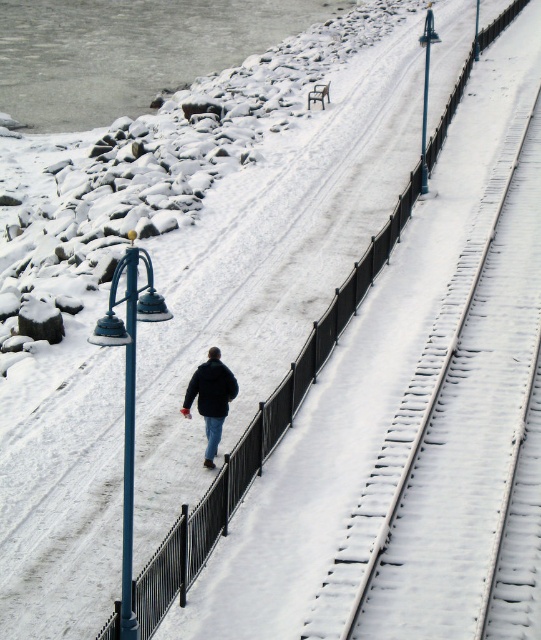
Question: In this image, where is dark blue jacket at center located relative to black matte jacket at center?

Choices:
 (A) left
 (B) right

Answer: (A)

Question: Which of the following is the closest to the observer?

Choices:
 (A) black matte jacket at center
 (B) dark blue jacket at center

Answer: (B)

Question: Does dark blue jacket at center come behind black matte jacket at center?

Choices:
 (A) yes
 (B) no

Answer: (B)

Question: Which point appears closest to the camera in this image?

Choices:
 (A) (229, 396)
 (B) (209, 401)

Answer: (B)

Question: Is dark blue jacket at center to the right of black matte jacket at center from the viewer's perspective?

Choices:
 (A) yes
 (B) no

Answer: (B)

Question: Which object appears farthest from the camera in this image?

Choices:
 (A) black matte jacket at center
 (B) dark blue jacket at center

Answer: (A)